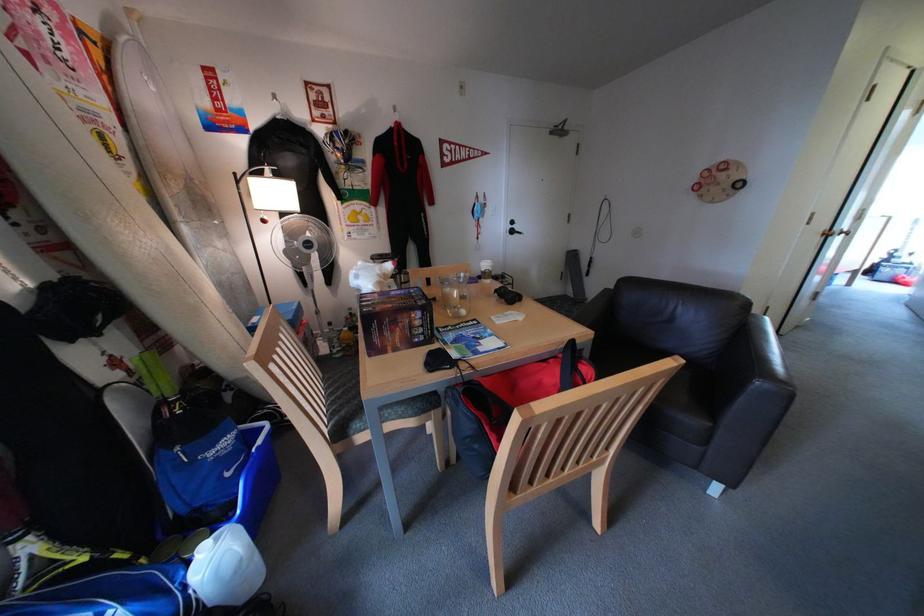
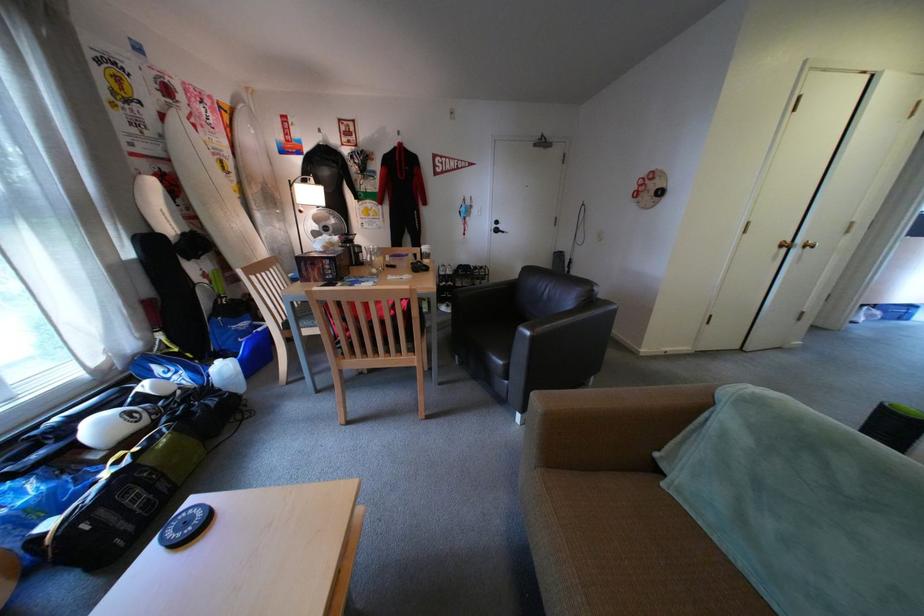
In the second image, find the point that corresponds to [521,233] in the first image.

(506, 232)